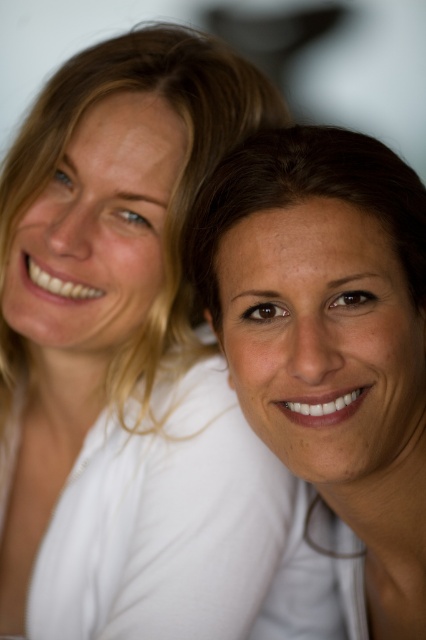
Does point (244, 440) come closer to viewer compared to point (373, 625)?

No, it is behind (373, 625).

Identify the location of matte white shirt at upper left. This screenshot has width=426, height=640. (126, 356).

Is point (129, 563) positioned behind point (337, 563)?

No, it is in front of (337, 563).

Locate an element on the screen. This screenshot has height=640, width=426. matte white shirt at upper left is located at coordinates (126, 356).